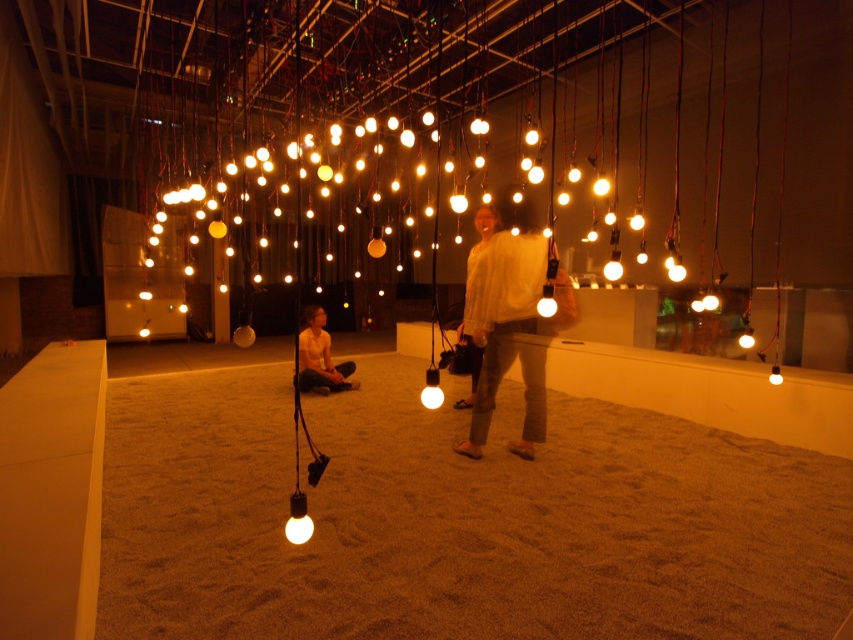
You are standing in the room and see both the brown textured sand at center and the white fluffy sweater at center. Which object is positioned to the left when facing the center of the room?

The brown textured sand at center is to the left of the white fluffy sweater at center when facing the center of the room.

You are standing at the point closest to the entrance of the room and want to move towards the back wall. Which of the two points, point (308, 314) or point (426, 394), is closer to the back wall?

Point (308, 314) is behind point (426, 394), so it is closer to the back wall.